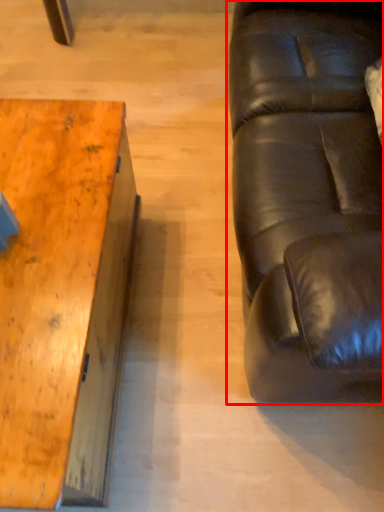
Question: From the image's perspective, what is the correct spatial relationship of studio couch (annotated by the red box) in relation to table?

Choices:
 (A) below
 (B) above

Answer: (B)